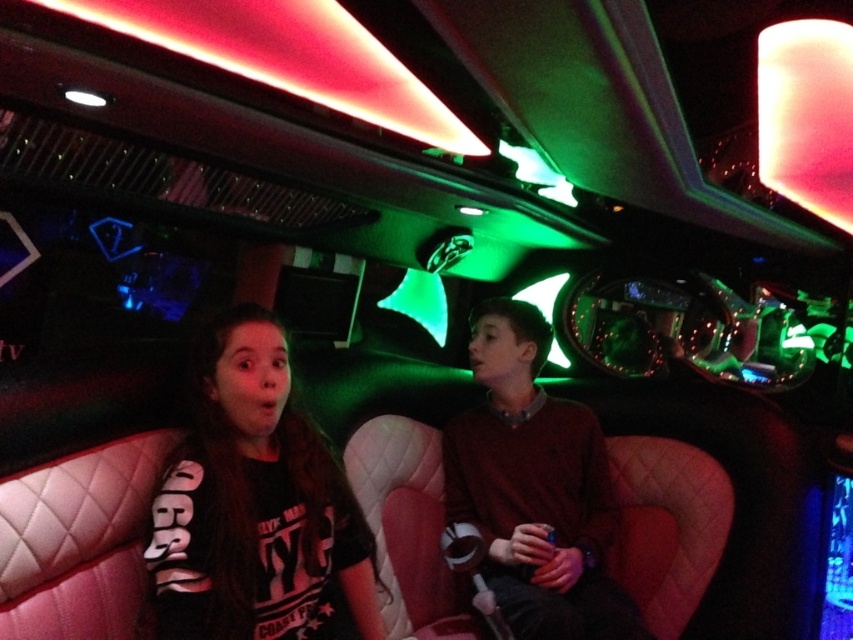
Question: Among these points, which one is farthest from the camera?

Choices:
 (A) (601, 440)
 (B) (280, 636)

Answer: (A)

Question: Considering the relative positions of black cotton shirt at center and matte brown sweater at center in the image provided, where is black cotton shirt at center located with respect to matte brown sweater at center?

Choices:
 (A) above
 (B) below

Answer: (A)

Question: Can you confirm if black cotton shirt at center is positioned to the right of matte brown sweater at center?

Choices:
 (A) no
 (B) yes

Answer: (A)

Question: Among these objects, which one is farthest from the camera?

Choices:
 (A) matte brown sweater at center
 (B) black cotton shirt at center

Answer: (A)

Question: Considering the relative positions of black cotton shirt at center and matte brown sweater at center in the image provided, where is black cotton shirt at center located with respect to matte brown sweater at center?

Choices:
 (A) below
 (B) above

Answer: (B)

Question: Among these objects, which one is farthest from the camera?

Choices:
 (A) black cotton shirt at center
 (B) matte brown sweater at center

Answer: (B)